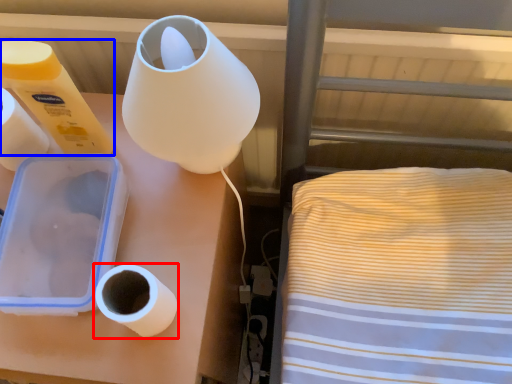
Question: Which point is closer to the camera, toilet paper (highlighted by a red box) or toilet paper (highlighted by a blue box)?

Choices:
 (A) toilet paper
 (B) toilet paper

Answer: (A)